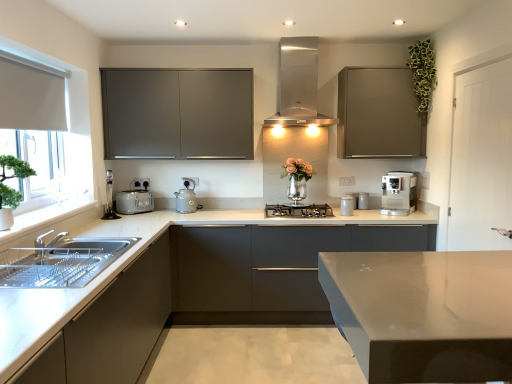
Question: From the image's perspective, would you say white marble sink at left is positioned over matte gray cabinet at upper right, which is the 6th cabinetry in bottom-to-top order?

Choices:
 (A) yes
 (B) no

Answer: (B)

Question: Is the depth of white marble sink at left less than that of matte gray cabinet at upper right, which is the 6th cabinetry in bottom-to-top order?

Choices:
 (A) no
 (B) yes

Answer: (B)

Question: Could you tell me if white marble sink at left is turned towards matte gray cabinet at upper right, which is the first cabinetry from top to bottom?

Choices:
 (A) no
 (B) yes

Answer: (A)

Question: From the image's perspective, would you say white marble sink at left is shown under matte gray cabinet at upper right, which is the 6th cabinetry in bottom-to-top order?

Choices:
 (A) no
 (B) yes

Answer: (B)

Question: Does white marble sink at left have a lesser width compared to matte gray cabinet at upper right, which is the 6th cabinetry in bottom-to-top order?

Choices:
 (A) yes
 (B) no

Answer: (A)

Question: From a real-world perspective, is white marble sink at left under matte gray cabinet at upper right, which is the 6th cabinetry in bottom-to-top order?

Choices:
 (A) no
 (B) yes

Answer: (B)

Question: Is satin silver toaster at lower left smaller than matte gray cabinet at upper center, placed as the fifth cabinetry when sorted from bottom to top?

Choices:
 (A) yes
 (B) no

Answer: (A)

Question: Is satin silver toaster at lower left positioned with its back to matte gray cabinet at upper center, arranged as the second cabinetry when viewed from the top?

Choices:
 (A) no
 (B) yes

Answer: (A)

Question: Is satin silver toaster at lower left bigger than matte gray cabinet at upper center, arranged as the second cabinetry when viewed from the top?

Choices:
 (A) yes
 (B) no

Answer: (B)

Question: Considering the relative positions of satin silver toaster at lower left and matte gray cabinet at upper center, placed as the fifth cabinetry when sorted from bottom to top, in the image provided, is satin silver toaster at lower left to the left of matte gray cabinet at upper center, placed as the fifth cabinetry when sorted from bottom to top, from the viewer's perspective?

Choices:
 (A) yes
 (B) no

Answer: (A)

Question: Is the depth of satin silver toaster at lower left less than that of matte gray cabinet at upper center, arranged as the second cabinetry when viewed from the top?

Choices:
 (A) no
 (B) yes

Answer: (A)

Question: From the image's perspective, does satin silver toaster at lower left appear higher than matte gray cabinet at upper center, placed as the fifth cabinetry when sorted from bottom to top?

Choices:
 (A) yes
 (B) no

Answer: (B)

Question: Is matte gray kettle at center, the 2th appliance viewed from the front, to the left of satin silver coffee machine at right, positioned as the 3th home appliance in left-to-right order, from the viewer's perspective?

Choices:
 (A) yes
 (B) no

Answer: (A)